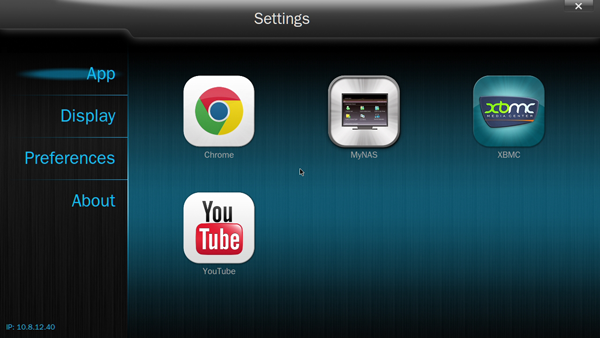
Find the location of a particular element. Image resolution: width=600 pixels, height=338 pixels. tv is located at coordinates (365, 107).